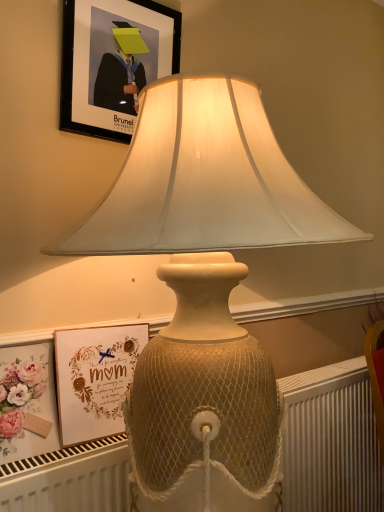
The width and height of the screenshot is (384, 512). Describe the element at coordinates (111, 62) in the screenshot. I see `black matte picture frame at upper center, the second picture frame in the bottom-to-top sequence` at that location.

The image size is (384, 512). I want to click on matte gold picture frame at lower left, positioned as the 2th picture frame in top-to-bottom order, so click(x=95, y=378).

Could you measure the distance between matte gold picture frame at lower left, positioned as the 2th picture frame in top-to-bottom order, and white textured radiator at lower center?

matte gold picture frame at lower left, positioned as the 2th picture frame in top-to-bottom order, and white textured radiator at lower center are 25.59 inches apart from each other.

Is matte gold picture frame at lower left, the first picture frame from the bottom, behind white textured radiator at lower center?

That is True.

From the image's perspective, is matte gold picture frame at lower left, positioned as the 2th picture frame in top-to-bottom order, located above white textured radiator at lower center?

Correct, matte gold picture frame at lower left, positioned as the 2th picture frame in top-to-bottom order, appears higher than white textured radiator at lower center in the image.

Which point is more distant from viewer, (57, 389) or (308, 507)?

The point (308, 507) is behind.

Where is `picture frame below the black matte picture frame at upper center, the second picture frame in the bottom-to-top sequence (from a real-world perspective)`? Image resolution: width=384 pixels, height=512 pixels. picture frame below the black matte picture frame at upper center, the second picture frame in the bottom-to-top sequence (from a real-world perspective) is located at coordinates (95, 378).

Is matte gold picture frame at lower left, the first picture frame from the bottom, facing away from black matte picture frame at upper center, the second picture frame in the bottom-to-top sequence?

matte gold picture frame at lower left, the first picture frame from the bottom, does not have its back to black matte picture frame at upper center, the second picture frame in the bottom-to-top sequence.

Is matte gold picture frame at lower left, positioned as the 2th picture frame in top-to-bottom order, next to black matte picture frame at upper center, the first picture frame in the top-to-bottom sequence, and touching it?

No, matte gold picture frame at lower left, positioned as the 2th picture frame in top-to-bottom order, is not next to black matte picture frame at upper center, the first picture frame in the top-to-bottom sequence.

Who is more distant, matte gold picture frame at lower left, positioned as the 2th picture frame in top-to-bottom order, or black matte picture frame at upper center, the second picture frame in the bottom-to-top sequence?

Positioned behind is black matte picture frame at upper center, the second picture frame in the bottom-to-top sequence.

Is point (286, 408) farther from camera compared to point (68, 86)?

Yes, it is behind point (68, 86).

Is white textured radiator at lower center taller or shorter than black matte picture frame at upper center, the second picture frame in the bottom-to-top sequence?

white textured radiator at lower center is taller than black matte picture frame at upper center, the second picture frame in the bottom-to-top sequence.

Is white textured radiator at lower center turned away from black matte picture frame at upper center, the second picture frame in the bottom-to-top sequence?

No, white textured radiator at lower center's orientation is not away from black matte picture frame at upper center, the second picture frame in the bottom-to-top sequence.

From the picture: Measure the distance from white textured radiator at lower center to black matte picture frame at upper center, the second picture frame in the bottom-to-top sequence.

white textured radiator at lower center and black matte picture frame at upper center, the second picture frame in the bottom-to-top sequence, are 3.51 feet apart from each other.

The height and width of the screenshot is (512, 384). I want to click on picture frame below the black matte picture frame at upper center, the first picture frame in the top-to-bottom sequence (from the image's perspective), so click(x=95, y=378).

Considering the sizes of objects black matte picture frame at upper center, the first picture frame in the top-to-bottom sequence, and matte gold picture frame at lower left, the first picture frame from the bottom, in the image provided, who is wider, black matte picture frame at upper center, the first picture frame in the top-to-bottom sequence, or matte gold picture frame at lower left, the first picture frame from the bottom,?

Wider between the two is matte gold picture frame at lower left, the first picture frame from the bottom.

Is black matte picture frame at upper center, the first picture frame in the top-to-bottom sequence, aimed at matte gold picture frame at lower left, positioned as the 2th picture frame in top-to-bottom order?

No.

Is there a large distance between white textured radiator at lower center and matte gold picture frame at lower left, positioned as the 2th picture frame in top-to-bottom order?

No.

Who is bigger, white textured radiator at lower center or matte gold picture frame at lower left, the first picture frame from the bottom?

white textured radiator at lower center is bigger.

Considering the sizes of objects white textured radiator at lower center and matte gold picture frame at lower left, the first picture frame from the bottom, in the image provided, who is taller, white textured radiator at lower center or matte gold picture frame at lower left, the first picture frame from the bottom,?

With more height is white textured radiator at lower center.

Which object is positioned more to the left, white textured radiator at lower center or matte gold picture frame at lower left, positioned as the 2th picture frame in top-to-bottom order?

matte gold picture frame at lower left, positioned as the 2th picture frame in top-to-bottom order.

Based on the photo, can you confirm if black matte picture frame at upper center, the first picture frame in the top-to-bottom sequence, is thinner than white textured radiator at lower center?

Correct, the width of black matte picture frame at upper center, the first picture frame in the top-to-bottom sequence, is less than that of white textured radiator at lower center.

Which is less distant, (112, 71) or (293, 480)?

The point (112, 71) is in front.

How different are the orientations of black matte picture frame at upper center, the first picture frame in the top-to-bottom sequence, and white textured radiator at lower center in degrees?

The angular difference between black matte picture frame at upper center, the first picture frame in the top-to-bottom sequence, and white textured radiator at lower center is 0.585 degrees.

Who is more distant, black matte picture frame at upper center, the first picture frame in the top-to-bottom sequence, or white textured radiator at lower center?

black matte picture frame at upper center, the first picture frame in the top-to-bottom sequence, is behind.

Starting from the white textured radiator at lower center, which picture frame is the 1st one behind? Please provide its 2D coordinates.

[(95, 378)]

Locate an element on the screen. The height and width of the screenshot is (512, 384). picture frame that is on the right side of matte gold picture frame at lower left, the first picture frame from the bottom is located at coordinates coord(111,62).

From the image, which object appears to be nearer to white textured radiator at lower center, black matte picture frame at upper center, the first picture frame in the top-to-bottom sequence, or matte gold picture frame at lower left, positioned as the 2th picture frame in top-to-bottom order?

matte gold picture frame at lower left, positioned as the 2th picture frame in top-to-bottom order, lies closer to white textured radiator at lower center than the other object.

When comparing their distances from black matte picture frame at upper center, the second picture frame in the bottom-to-top sequence, does matte gold picture frame at lower left, the first picture frame from the bottom, or white textured radiator at lower center seem further?

white textured radiator at lower center.

From the image, which object appears to be nearer to matte gold picture frame at lower left, positioned as the 2th picture frame in top-to-bottom order, white textured radiator at lower center or black matte picture frame at upper center, the first picture frame in the top-to-bottom sequence?

Among the two, black matte picture frame at upper center, the first picture frame in the top-to-bottom sequence, is located nearer to matte gold picture frame at lower left, positioned as the 2th picture frame in top-to-bottom order.

Estimate the real-world distances between objects in this image. Which object is closer to matte gold picture frame at lower left, positioned as the 2th picture frame in top-to-bottom order, black matte picture frame at upper center, the first picture frame in the top-to-bottom sequence, or white textured radiator at lower center?

black matte picture frame at upper center, the first picture frame in the top-to-bottom sequence, is positioned closer to the anchor matte gold picture frame at lower left, positioned as the 2th picture frame in top-to-bottom order.

Based on the photo, based on their spatial positions, is white textured radiator at lower center or matte gold picture frame at lower left, the first picture frame from the bottom, further from black matte picture frame at upper center, the first picture frame in the top-to-bottom sequence?

Among the two, white textured radiator at lower center is located further to black matte picture frame at upper center, the first picture frame in the top-to-bottom sequence.

Which object lies nearer to the anchor point white textured radiator at lower center, matte gold picture frame at lower left, the first picture frame from the bottom, or black matte picture frame at upper center, the first picture frame in the top-to-bottom sequence?

Among the two, matte gold picture frame at lower left, the first picture frame from the bottom, is located nearer to white textured radiator at lower center.

Locate an element on the screen. This screenshot has height=512, width=384. picture frame between black matte picture frame at upper center, the second picture frame in the bottom-to-top sequence, and white textured radiator at lower center vertically is located at coordinates (95, 378).